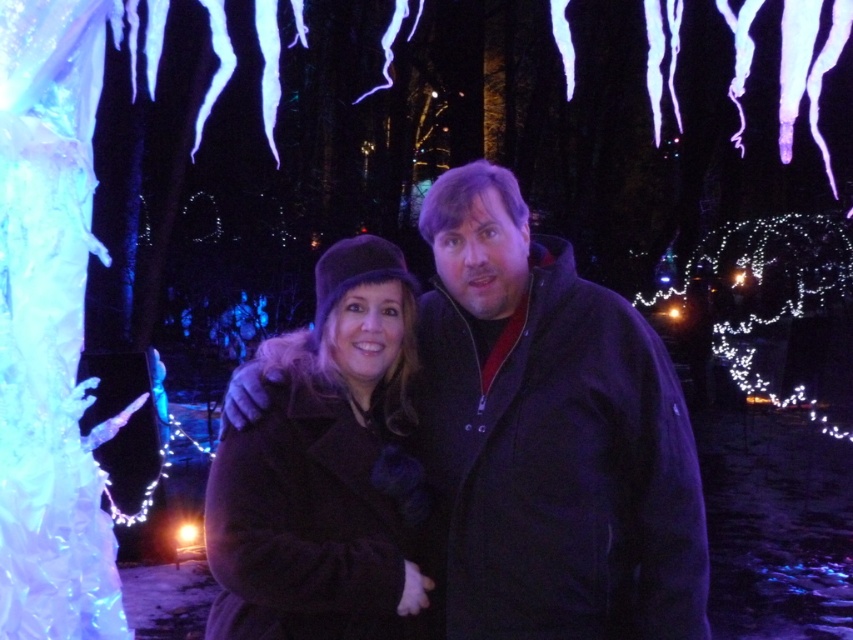
You are a photographer adjusting the camera focus. You need to ensure both the dark brown coat at center and the velvet black coat at center are in focus. The camera has a depth of field that can cover 16 inches. Will both coats be in focus?

The dark brown coat at center and the velvet black coat at center are 15.82 inches apart from each other. Since the distance between them is less than the camera depth of field of 16 inches, both coats will be in focus.

You are a photographer standing in front of the dark brown coat at center and want to take a closeup shot. Your camera has a minimum focusing distance of 2 meters. Can you take the photo without moving closer?

The dark brown coat at center is 2.35 meters from viewer, so yes, the camera can focus on it since the distance is within the minimum focusing range of 2 meters.